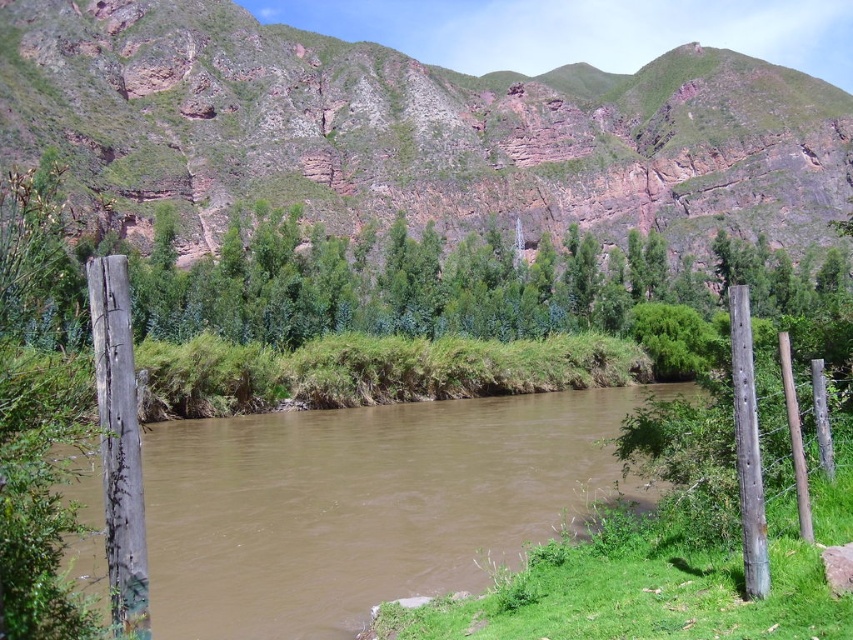
Question: Estimate the real-world distances between objects in this image. Which object is closer to the gray weathered wood post at right?

Choices:
 (A) brown muddy water at center
 (B) weathered wood post at left

Answer: (B)

Question: Among these points, which one is nearest to the camera?

Choices:
 (A) (489, 496)
 (B) (105, 515)
 (C) (746, 556)

Answer: (B)

Question: Can you confirm if rustic rock cliff at center is positioned to the left of weathered wood post at left?

Choices:
 (A) yes
 (B) no

Answer: (B)

Question: Is rustic rock cliff at center bigger than brown muddy water at center?

Choices:
 (A) no
 (B) yes

Answer: (B)

Question: Does brown muddy water at center appear over weathered wood post at left?

Choices:
 (A) yes
 (B) no

Answer: (B)

Question: Estimate the real-world distances between objects in this image. Which object is farther from the gray weathered wood post at right?

Choices:
 (A) weathered wood post at left
 (B) rustic rock cliff at center

Answer: (B)